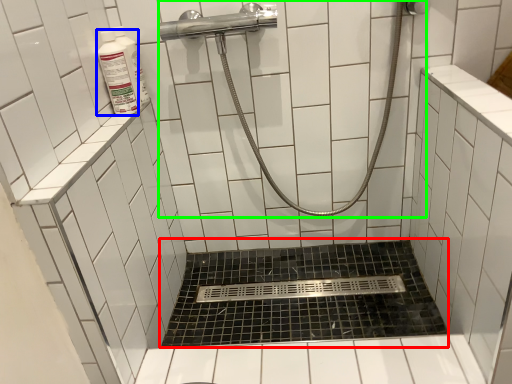
Question: Considering the real-world distances, which object is farthest from bath (highlighted by a red box)? cleaning product (highlighted by a blue box) or shower (highlighted by a green box)?

Choices:
 (A) cleaning product
 (B) shower

Answer: (A)